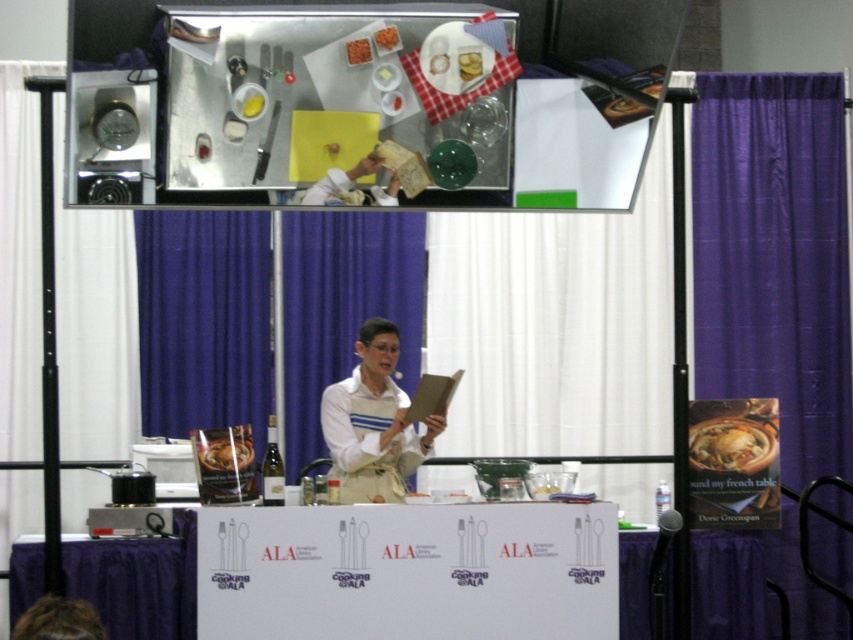
You are standing in the convention hall and want to approach the purple fabric table at lower left to participate in the cooking demonstration. If your walking distance from the table is 5 meters, can you reach it within 10 seconds if you walk at a normal pace of 1.5 meters per second?

The purple fabric table at lower left is 4.99 meters away from the viewer. Since you are 5 meters away, you can reach it in approximately 3.33 seconds, which is well within the 10 seconds timeframe.

You are a photographer standing at the event. You need to take a closeup photo of the golden brown crusty bread at center. The camera you have can focus on objects within 2 meters. Can you take the photo without moving closer?

The golden brown crusty bread at center is 5.32 meters away from camera. Since the camera can only focus within 2 meters, you cannot take the closeup photo without moving closer.